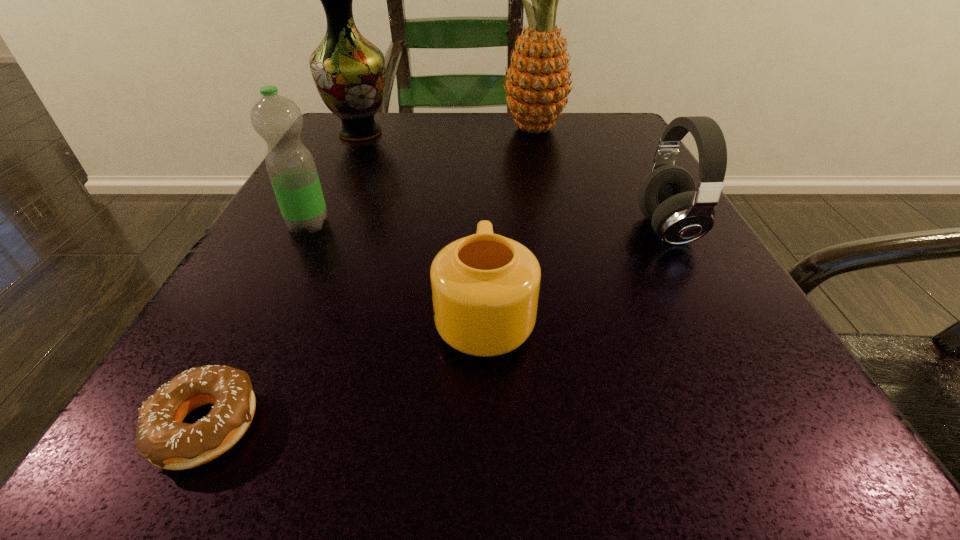
This screenshot has height=540, width=960. Find the location of `vacant space at the near edge of the desktop`. vacant space at the near edge of the desktop is located at coordinates (560, 436).

In the image, there is a desktop. At what (x,y) coordinates should I click in order to perform the action: click on vacant space at the left edge. Please return your answer as a coordinate pair (x, y). This screenshot has height=540, width=960. Looking at the image, I should click on (253, 248).

The width and height of the screenshot is (960, 540). In order to click on vacant space at the right edge in this screenshot , I will do (709, 389).

In order to click on vacant position at the far left corner of the desktop in this screenshot , I will do `click(323, 152)`.

Image resolution: width=960 pixels, height=540 pixels. What are the coordinates of `free space at the near left corner of the desktop` in the screenshot? It's located at (127, 429).

In the image, there is a desktop. In order to click on free space at the far right corner in this screenshot , I will do `click(597, 112)`.

Identify the location of vacant region at the near right corner. (699, 489).

Locate an element on the screen. This screenshot has width=960, height=540. free space between the water bottle and the vase is located at coordinates (334, 179).

Locate an element on the screen. free point between the fifth tallest object and the pineapple is located at coordinates (509, 222).

This screenshot has width=960, height=540. Find the location of `vacant space in between the shortest object and the mug`. vacant space in between the shortest object and the mug is located at coordinates (346, 371).